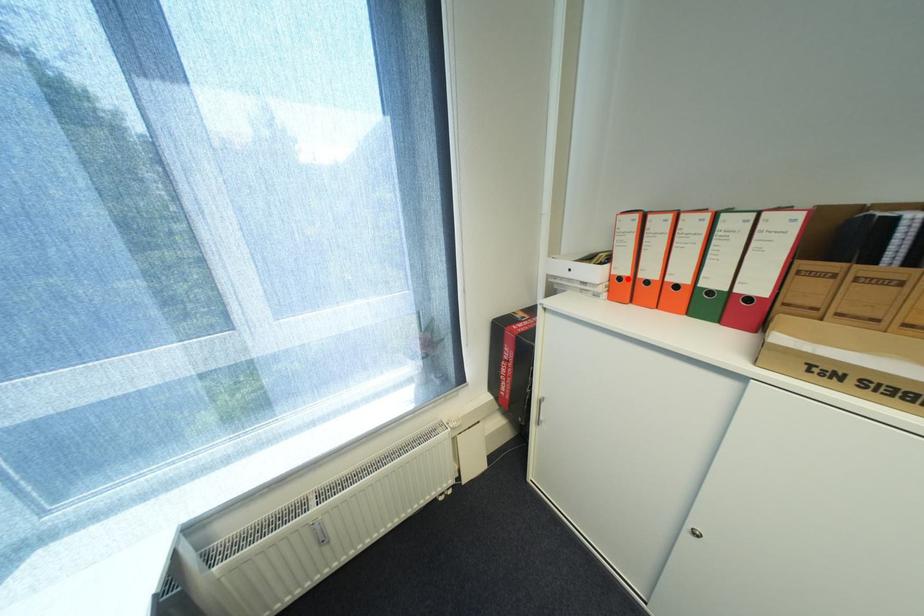
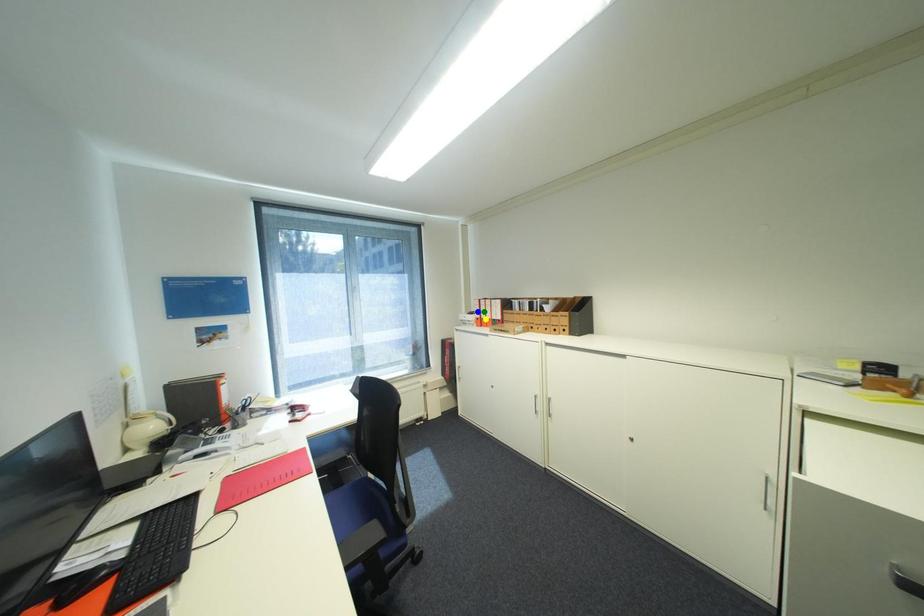
Question: I am providing you with two images of the same scene from different viewpoints. A red point is marked on the first image. You are given multiple points on the second image. Can you choose the point in image 2 that corresponds to the point in image 1?

Choices:
 (A) yellow point
 (B) blue point
 (C) green point

Answer: (A)